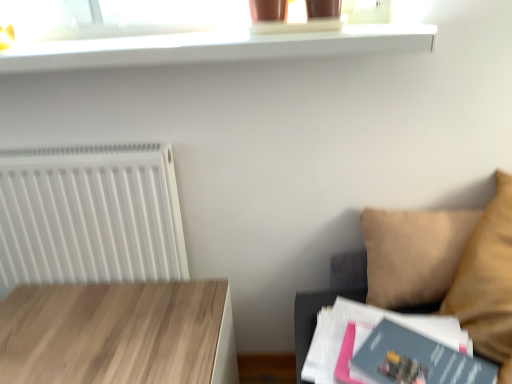
Question: In terms of height, does white glossy shelf at upper center look taller or shorter compared to light wood table at lower left?

Choices:
 (A) tall
 (B) short

Answer: (B)

Question: Would you say white glossy shelf at upper center is to the left or to the right of light wood table at lower left in the picture?

Choices:
 (A) right
 (B) left

Answer: (A)

Question: Based on their relative distances, which object is nearer to the matte gray paperback book at lower right, the first paperback book positioned from the front?

Choices:
 (A) beige fabric couch at right
 (B) white glossy shelf at upper center
 (C) matte gray paperback book at lower right, the first paperback book positioned from the back
 (D) light wood table at lower left
 (E) white plastic radiator at left

Answer: (C)

Question: Which is farther from the beige fabric couch at right?

Choices:
 (A) light wood table at lower left
 (B) matte gray paperback book at lower right, the second paperback book viewed from the front
 (C) white plastic radiator at left
 (D) white glossy shelf at upper center
 (E) matte gray paperback book at lower right, which is the 2th paperback book from back to front

Answer: (C)